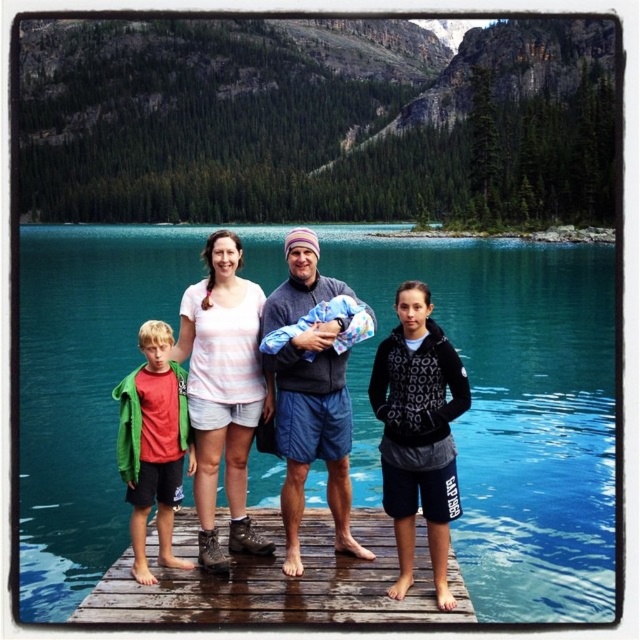
Question: In this image, where is brown wooden dock at center located relative to white cotton shirt at center?

Choices:
 (A) above
 (B) below

Answer: (B)

Question: Does brown wooden dock at center have a larger size compared to black hoodie at center?

Choices:
 (A) yes
 (B) no

Answer: (B)

Question: Which of the following is the closest to the observer?

Choices:
 (A) red cotton shirt at left
 (B) black hoodie at center

Answer: (B)

Question: Can you confirm if white cotton shirt at center is smaller than black hoodie at center?

Choices:
 (A) yes
 (B) no

Answer: (A)

Question: Which of these objects is positioned farthest from the red cotton shirt at left?

Choices:
 (A) blue fleece jacket at center
 (B) matte white shirt at center

Answer: (A)

Question: Which object is positioned closest to the black hoodie at center?

Choices:
 (A) green forested mountain at upper center
 (B) matte white shirt at center
 (C) brown wooden dock at center

Answer: (B)